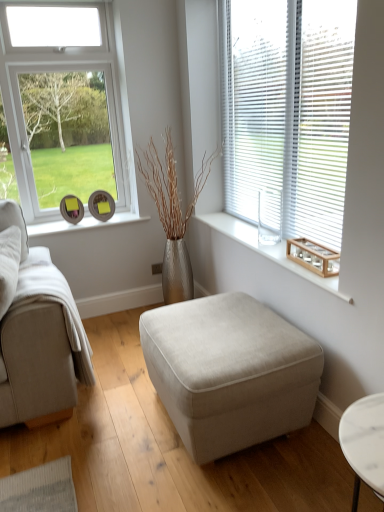
Question: From a real-world perspective, is wooden box at right above or below wooden tray at right?

Choices:
 (A) below
 (B) above

Answer: (B)

Question: From the image's perspective, is wooden box at right positioned above or below wooden tray at right?

Choices:
 (A) below
 (B) above

Answer: (A)

Question: Estimate the real-world distances between objects in this image. Which object is farther from the white plastic blinds at upper right?

Choices:
 (A) wooden box at right
 (B) beige fabric ottoman at center
 (C) wooden tray at right

Answer: (B)

Question: Estimate the real-world distances between objects in this image. Which object is closer to the beige fabric ottoman at center?

Choices:
 (A) wooden tray at right
 (B) wooden box at right
 (C) white plastic blinds at upper right

Answer: (A)